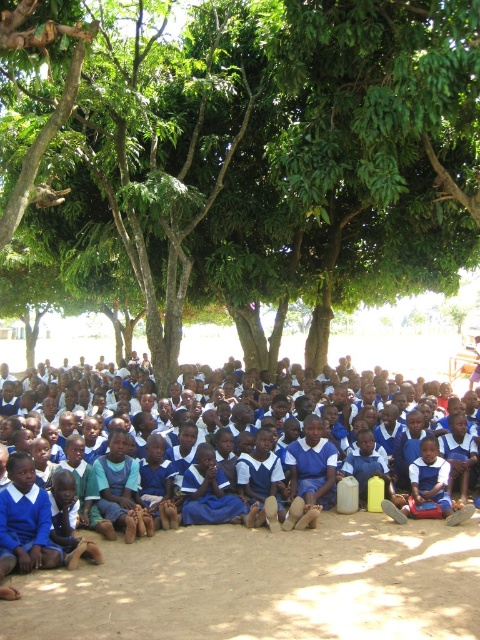
Between green leafy tree at center and blue fabric uniform at center, which one is positioned lower?

Positioned lower is blue fabric uniform at center.

Does green leafy tree at center lie behind blue fabric uniform at center?

That is True.

Measure the distance between point (214, 97) and camera.

They are 68.49 feet apart.

This screenshot has height=640, width=480. Find the location of `green leafy tree at center`. green leafy tree at center is located at coordinates (264, 150).